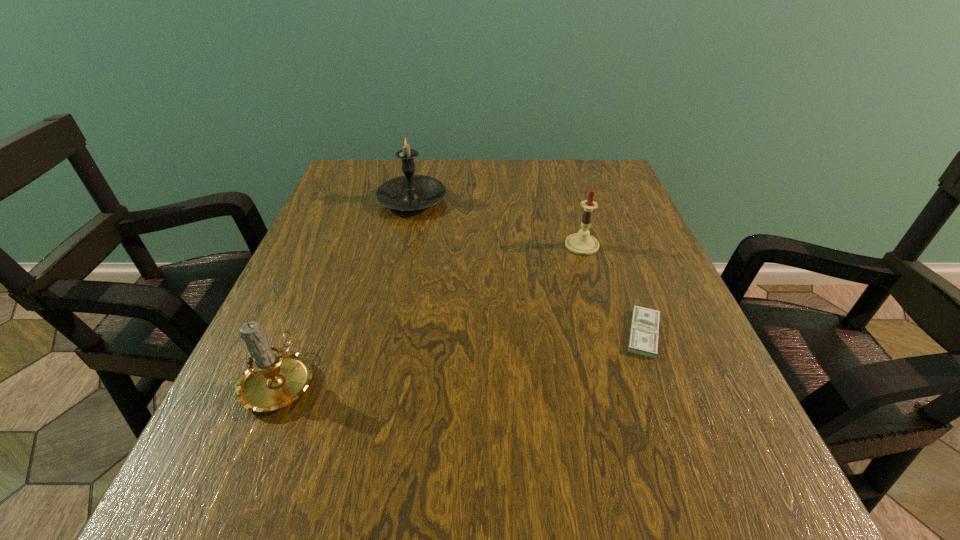
Locate an element on the screen. The width and height of the screenshot is (960, 540). vacant space positioned 0.060m on the left of the shortest object is located at coordinates (586, 334).

This screenshot has width=960, height=540. I want to click on object present at the far edge, so click(410, 192).

Where is `candle at the right edge`? candle at the right edge is located at coordinates (582, 243).

You are a GUI agent. You are given a task and a screenshot of the screen. Output one action in this format:
    pyautogui.click(x=<x>, y=<y>)
    Task: Click on the money present at the right edge
    This screenshot has width=960, height=540.
    Given the screenshot: What is the action you would take?
    pyautogui.click(x=644, y=331)

The image size is (960, 540). What are the coordinates of `object present at the far left corner` in the screenshot? It's located at (410, 192).

The image size is (960, 540). In the image, there is a desktop. In order to click on free space at the far edge in this screenshot , I will do `click(457, 193)`.

Image resolution: width=960 pixels, height=540 pixels. In the image, there is a desktop. In order to click on vacant space at the near edge in this screenshot , I will do `click(598, 518)`.

Where is `vacant position at the left edge of the desktop`? vacant position at the left edge of the desktop is located at coordinates (338, 287).

What are the coordinates of `free space at the right edge` in the screenshot? It's located at (675, 353).

Identify the location of vacant area at the far left corner. (366, 182).